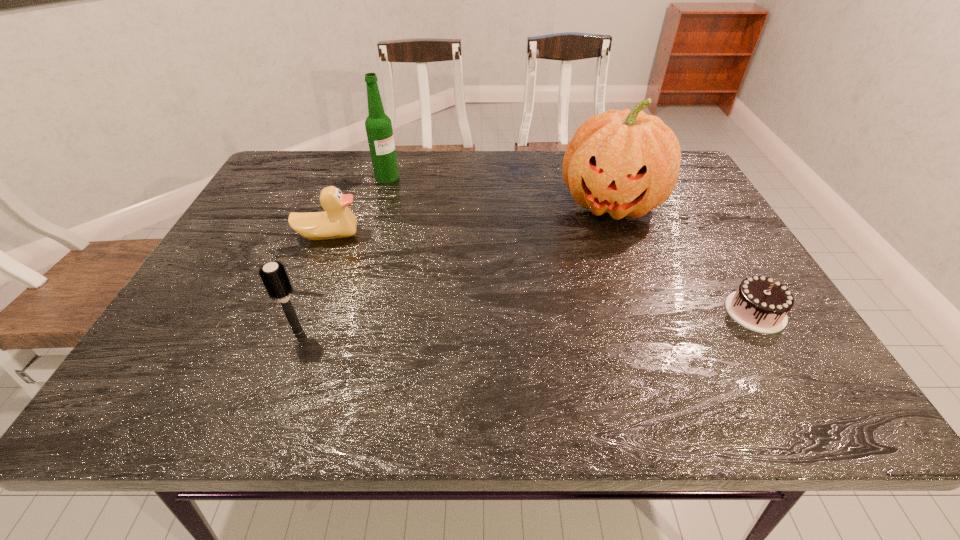
Identify the location of empty space that is in between the hairbrush and the beer bottle. (343, 254).

Find the location of a particular element. Image resolution: width=960 pixels, height=540 pixels. free point between the beer bottle and the chocolate cake is located at coordinates (571, 244).

In order to click on unoccupied position between the chocolate cake and the second shortest object in this screenshot , I will do `click(542, 273)`.

Locate an element on the screen. empty location between the fourth tallest object and the beer bottle is located at coordinates (358, 206).

Where is `free space between the hairbrush and the pumpkin`? The image size is (960, 540). free space between the hairbrush and the pumpkin is located at coordinates (454, 267).

You are a GUI agent. You are given a task and a screenshot of the screen. Output one action in this format:
    pyautogui.click(x=<x>, y=<y>)
    Task: Click on the vacant space that is in between the duck and the pumpkin
    
    Given the screenshot: What is the action you would take?
    pyautogui.click(x=469, y=219)

I want to click on free space that is in between the beer bottle and the hairbrush, so click(343, 254).

You are a GUI agent. You are given a task and a screenshot of the screen. Output one action in this format:
    pyautogui.click(x=<x>, y=<y>)
    Task: Click on the empty location between the beer bottle and the rightmost object
    Image resolution: width=960 pixels, height=540 pixels.
    Given the screenshot: What is the action you would take?
    pyautogui.click(x=571, y=244)

Locate an element on the screen. The height and width of the screenshot is (540, 960). free spot between the second object from right to left and the duck is located at coordinates (469, 219).

This screenshot has width=960, height=540. I want to click on object identified as the second closest to the pumpkin, so [378, 125].